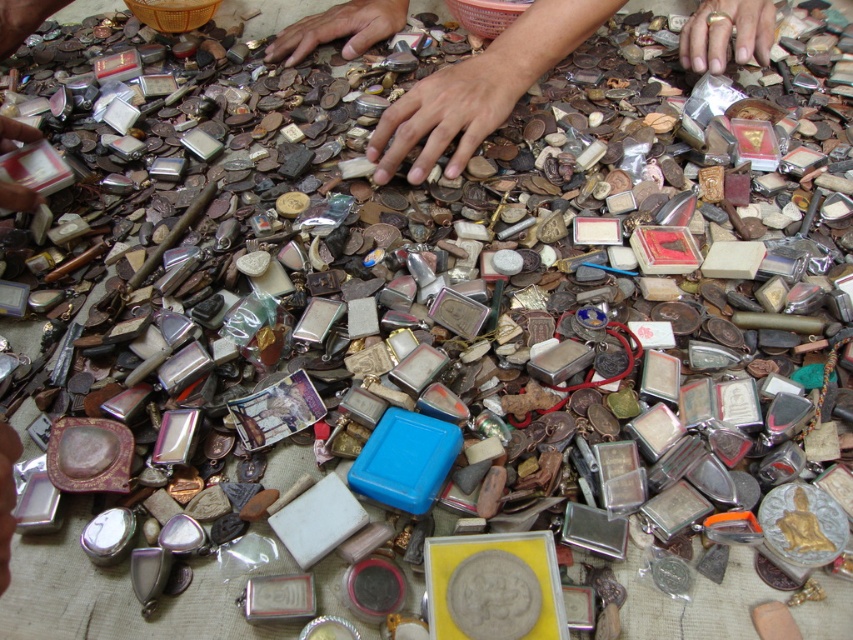
Question: Is smooth brown hands at center closer to camera compared to matte silver coin at center?

Choices:
 (A) no
 (B) yes

Answer: (A)

Question: Considering the relative positions of brown matte hand at upper center and matte black coin at upper left in the image provided, where is brown matte hand at upper center located with respect to matte black coin at upper left?

Choices:
 (A) above
 (B) below

Answer: (A)

Question: Which object is positioned farthest from the smooth brown hands at center?

Choices:
 (A) brown matte hand at upper center
 (B) gold metallic ring at upper center

Answer: (A)

Question: Which of the following is the closest to the observer?

Choices:
 (A) matte black coin at upper left
 (B) matte silver coin at center

Answer: (A)

Question: Does gold metallic ring at upper center come behind brown matte hand at upper center?

Choices:
 (A) no
 (B) yes

Answer: (A)

Question: Which object is the farthest from the matte silver coin at center?

Choices:
 (A) matte black coin at upper left
 (B) smooth brown hands at center
 (C) brown matte hand at upper center

Answer: (A)